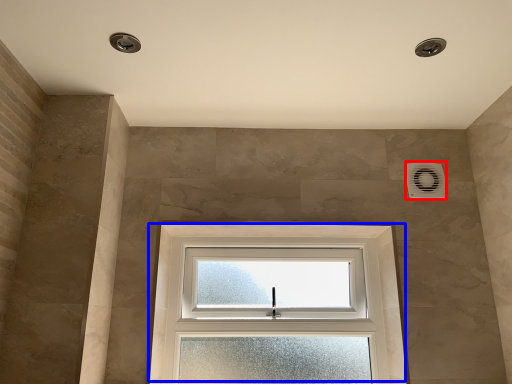
Question: Which of the following is the closest to the observer, air conditioning (highlighted by a red box) or window (highlighted by a blue box)?

Choices:
 (A) air conditioning
 (B) window

Answer: (B)